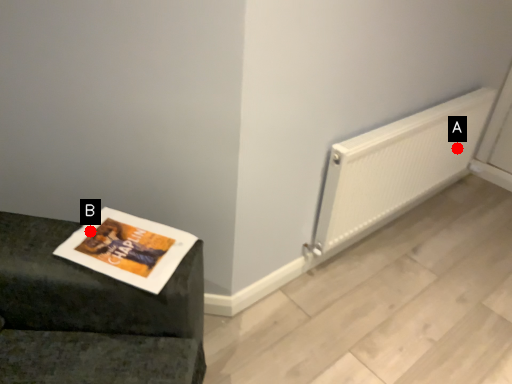
Question: Two points are circled on the image, labeled by A and B beside each circle. Which point is farther from the camera taking this photo?

Choices:
 (A) A is further
 (B) B is further

Answer: (A)